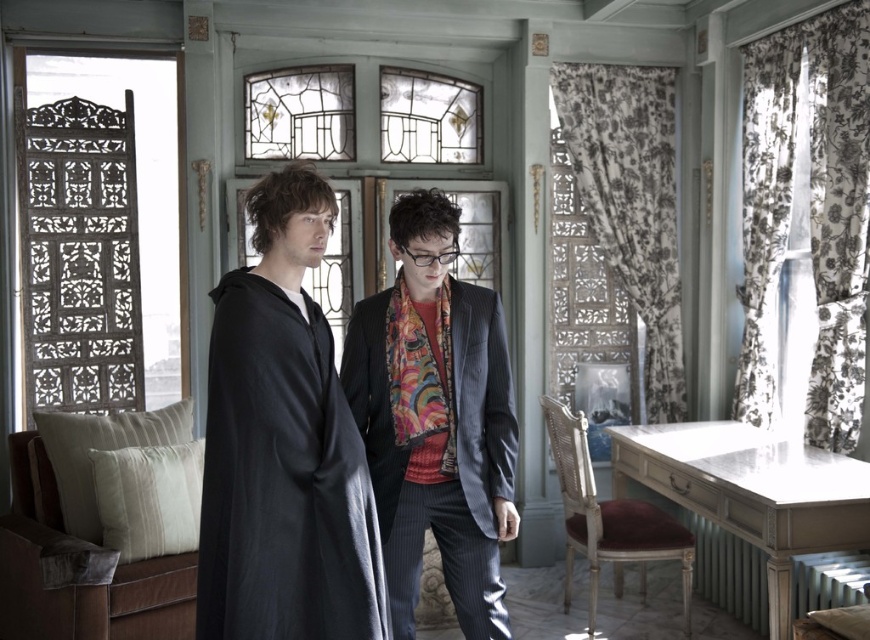
Question: Is matte black cloak at center positioned at the back of velvet scarf at center?

Choices:
 (A) no
 (B) yes

Answer: (A)

Question: Where is matte black cloak at center located in relation to velvet scarf at center in the image?

Choices:
 (A) right
 (B) left

Answer: (B)

Question: Which of the following is the closest to the observer?

Choices:
 (A) (419, 216)
 (B) (325, 230)

Answer: (B)

Question: Which object is farther from the camera taking this photo?

Choices:
 (A) velvet scarf at center
 (B) matte black cloak at center

Answer: (A)

Question: Does matte black cloak at center have a greater width compared to velvet scarf at center?

Choices:
 (A) no
 (B) yes

Answer: (A)

Question: Which point is closer to the camera?

Choices:
 (A) (463, 339)
 (B) (239, 429)

Answer: (B)